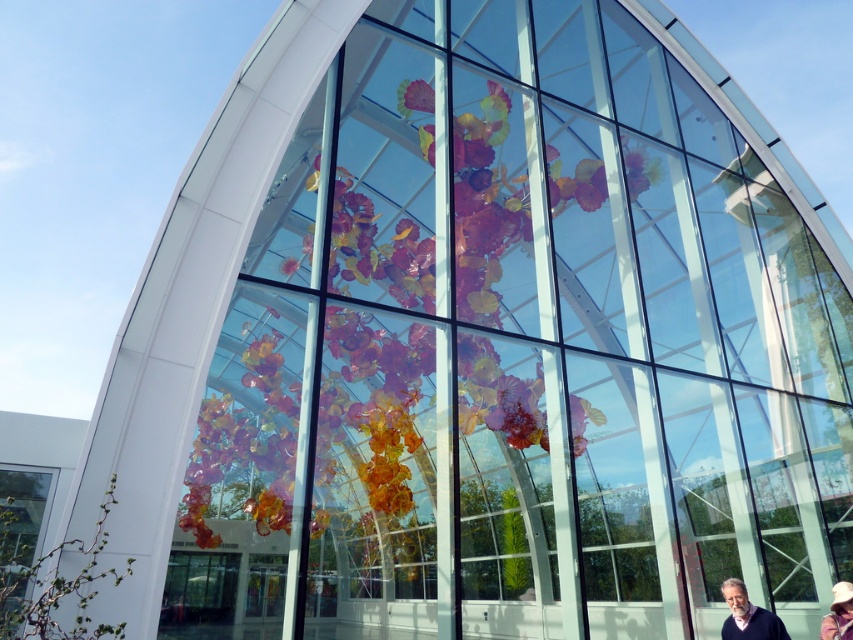
Based on the scene description, where is the translucent glass flower at center located in terms of coordinates?

The translucent glass flower at center is located at coordinates point (485, 209).

You are standing in front of the modern architectural structure and want to take a photo of the white textured hat at lower right without the translucent glass flower at center blocking it. How can you position yourself to achieve this?

Move to the side so that the white textured hat at lower right is no longer behind the translucent glass flower at center. Since the white textured hat at lower right is behind the translucent glass flower at center, shifting your position to the left or right will allow you to see the hat without the flower obstructing it.

You are an interior designer assessing the space. You need to determine if the translucent glass flower at center can be placed on a shelf that currently holds the matte black sweater at lower right. The shelf has limited width. Based on their widths, will the flower fit without overlapping the sweater?

The translucent glass flower at center is wider than the matte black sweater at lower right. Since the shelf has limited width, placing the flower next to the sweater may cause overlap due to its greater width.